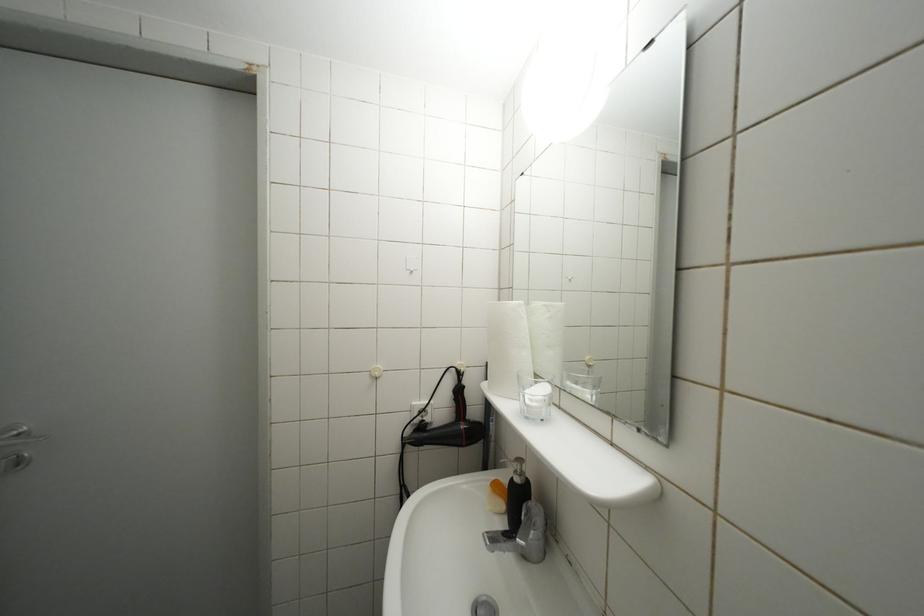
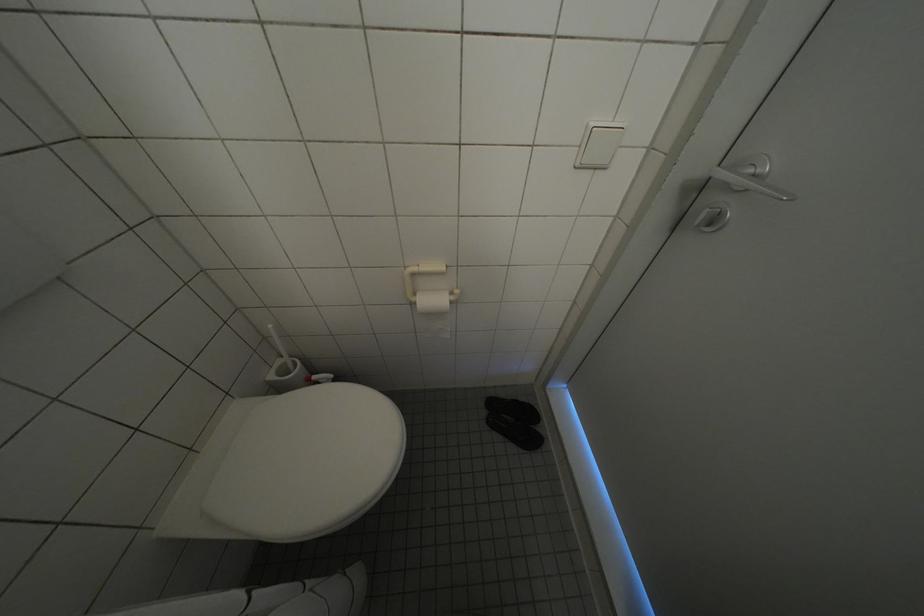
The first image is from the beginning of the video and the second image is from the end. How did the camera likely rotate when shooting the video?

The camera's rotation is toward left-down.